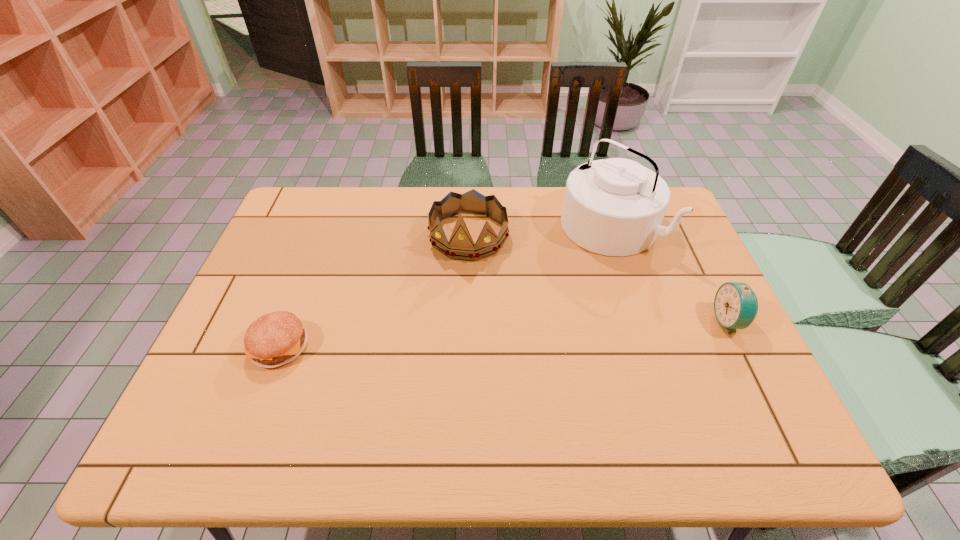
At what (x,y) coordinates should I click in order to perform the action: click on object present at the left edge. Please return your answer as a coordinate pair (x, y). The width and height of the screenshot is (960, 540). Looking at the image, I should click on (274, 339).

I want to click on alarm clock located in the right edge section of the desktop, so click(x=735, y=305).

At what (x,y) coordinates should I click in order to perform the action: click on kettle that is at the right edge. Please return your answer as a coordinate pair (x, y). This screenshot has height=540, width=960. Looking at the image, I should click on (615, 207).

The height and width of the screenshot is (540, 960). I want to click on object positioned at the far right corner, so click(x=615, y=207).

You are a GUI agent. You are given a task and a screenshot of the screen. Output one action in this format:
    pyautogui.click(x=<x>, y=<y>)
    Task: Click on the vacant space at the far edge of the desktop
    
    Given the screenshot: What is the action you would take?
    pyautogui.click(x=353, y=190)

This screenshot has width=960, height=540. Identify the location of free space at the near edge of the desktop. (277, 401).

The width and height of the screenshot is (960, 540). Find the location of `vacant area at the left edge of the desktop`. vacant area at the left edge of the desktop is located at coordinates (274, 233).

This screenshot has width=960, height=540. In the image, there is a desktop. What are the coordinates of `blank space at the right edge` in the screenshot? It's located at [x=693, y=357].

The width and height of the screenshot is (960, 540). In the image, there is a desktop. What are the coordinates of `vacant space at the near left corner` in the screenshot? It's located at (204, 394).

This screenshot has width=960, height=540. What are the coordinates of `free space between the rightmost object and the leftmost object` in the screenshot? It's located at (505, 333).